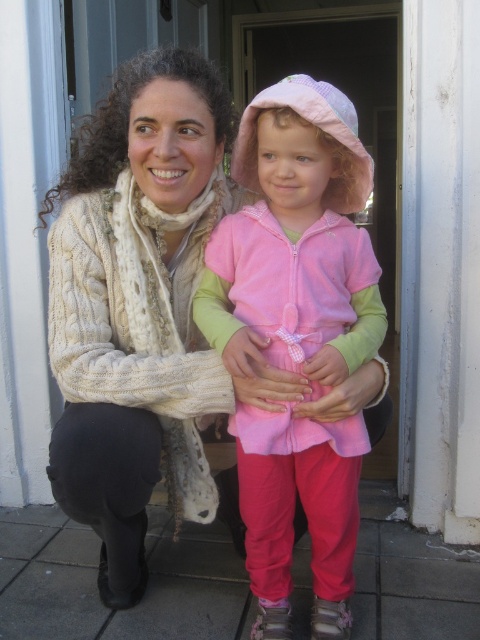
Between white cable-knit sweater at center and pink fleece jacket at center, which one has less height?

pink fleece jacket at center

Does white cable-knit sweater at center have a greater width compared to pink fleece jacket at center?

Yes, white cable-knit sweater at center is wider than pink fleece jacket at center.

Image resolution: width=480 pixels, height=640 pixels. What do you see at coordinates (135, 307) in the screenshot? I see `white cable-knit sweater at center` at bounding box center [135, 307].

This screenshot has height=640, width=480. Find the location of `white cable-knit sweater at center`. white cable-knit sweater at center is located at coordinates (135, 307).